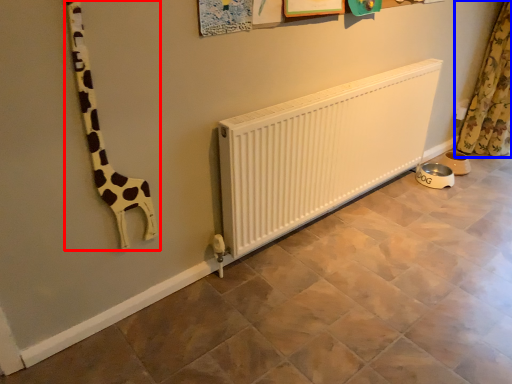
Question: Which object is closer to the camera taking this photo, giraffe (highlighted by a red box) or curtain (highlighted by a blue box)?

Choices:
 (A) giraffe
 (B) curtain

Answer: (A)